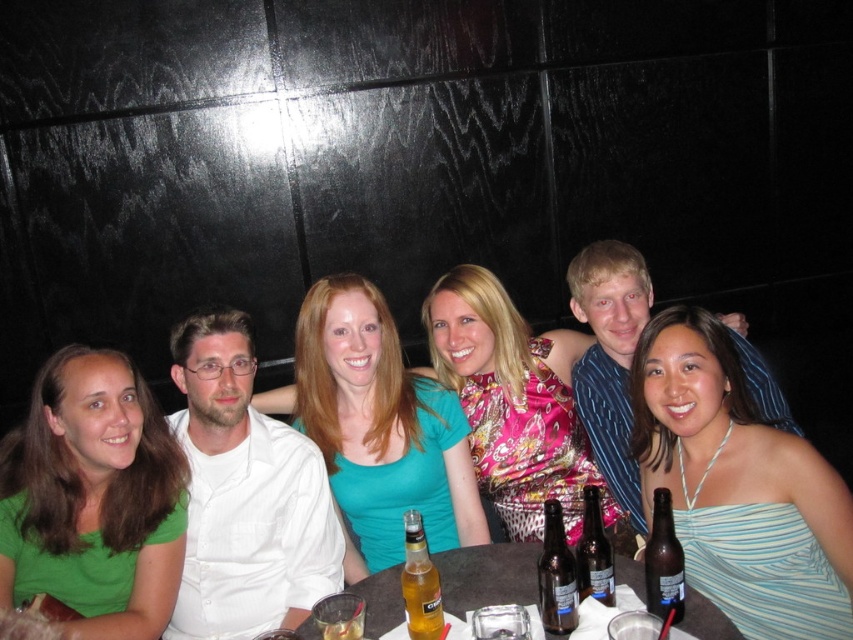
You are a photographer setting up for a group photo. You need to ensure that the teal fabric shirt at center and the smooth dark wood table at center are both in focus. Which object should you adjust your camera focus on first to ensure depth of field?

The smooth dark wood table at center is thicker than the teal fabric shirt at center, so you should focus on the smooth dark wood table at center first to ensure proper depth of field.

You are standing in front of a group photo and want to know the exact position of the blue striped dress at center. Can you tell me where it is located in terms of coordinates?

The blue striped dress at center is located at coordinates point (740,486).

From the picture: You are a photographer trying to capture a closeup of the person at point (x=701, y=621) and the person at point (x=549, y=532). Since you want both subjects to be in focus, which point should you focus on?

You should focus on point (x=549, y=532) because it is farther from the camera than point (x=701, y=621). By focusing on the farther point, the closer subject will also be in focus due to the depth of field.